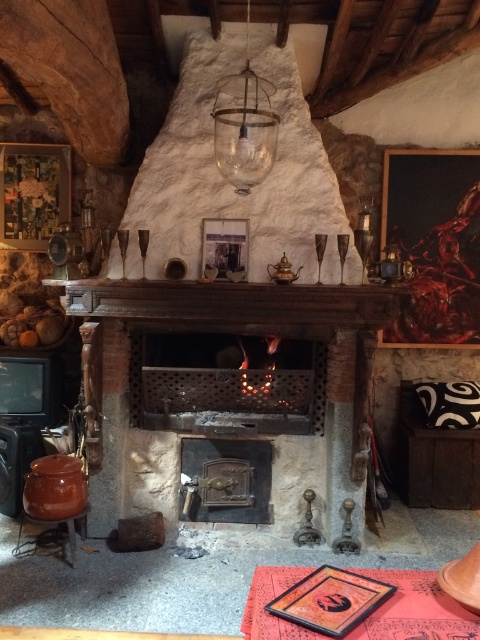
Question: Which of the following is the farthest from the observer?

Choices:
 (A) (240, 81)
 (B) (335, 426)
 (C) (197, 321)
 (D) (36, 547)

Answer: (B)

Question: Is rustic wood fireplace at center further to camera compared to transparent glass lamp at upper center?

Choices:
 (A) no
 (B) yes

Answer: (B)

Question: Observing the image, what is the correct spatial positioning of rustic wood fireplace at center in reference to transparent glass lamp at upper center?

Choices:
 (A) below
 (B) above

Answer: (A)

Question: Among these points, which one is farthest from the camera?

Choices:
 (A) (29, 547)
 (B) (140, 316)

Answer: (B)

Question: From the image, what is the correct spatial relationship of rustic wood fireplace at center in relation to transparent glass lamp at upper center?

Choices:
 (A) right
 (B) left

Answer: (B)

Question: Which object appears farthest from the camera in this image?

Choices:
 (A) transparent glass lamp at upper center
 (B) brown wooden mantle at center
 (C) rustic wood fireplace at center
 (D) brown wooden stool at lower left

Answer: (C)